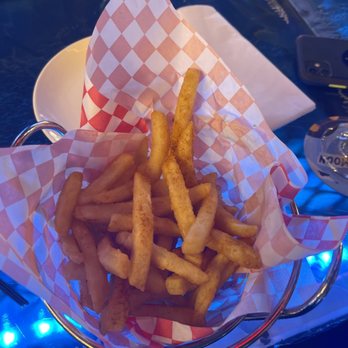
In order to click on ceramic white bowl in this screenshot , I will do `click(75, 99)`.